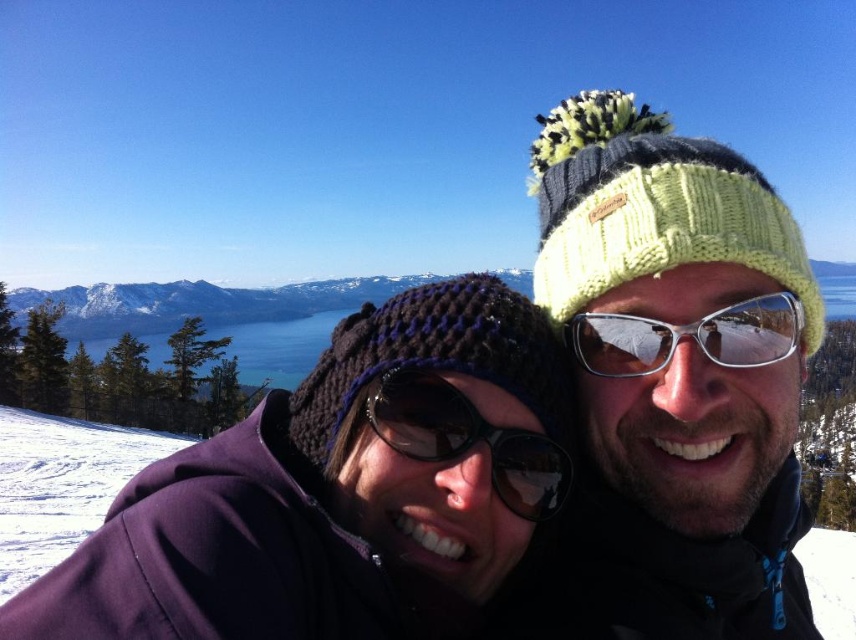
Question: Which point is farther from the camera taking this photo?

Choices:
 (A) (458, 419)
 (B) (593, 368)
 (C) (553, 193)

Answer: (C)

Question: Is knitted yellow hat at center thinner than black reflective sunglasses at center?

Choices:
 (A) yes
 (B) no

Answer: (B)

Question: Which of the following is the closest to the observer?

Choices:
 (A) (470, 328)
 (B) (587, 106)
 (C) (498, 451)

Answer: (C)

Question: Does purple knitted beanie at center have a greater width compared to silver reflective glasses at center?

Choices:
 (A) yes
 (B) no

Answer: (A)

Question: Which point is farther from the camera taking this photo?

Choices:
 (A) pyautogui.click(x=366, y=403)
 (B) pyautogui.click(x=159, y=616)

Answer: (A)

Question: Does black reflective sunglasses at center have a greater width compared to silver reflective glasses at center?

Choices:
 (A) yes
 (B) no

Answer: (A)